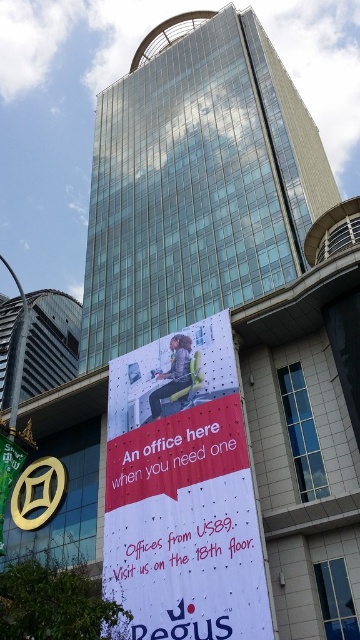
You are a delivery drone with a wingspan of 1.5 meters. You need to fly from the smooth metallic pole at left to the glassy skyscraper at upper left. Can you safely navigate the space between them without colliding?

The distance between the glassy skyscraper at upper left and the smooth metallic pole at left is 12.08 meters. Since your wingspan is only 1.5 meters, there is ample space for you to navigate safely between them without collision.

You are a window cleaner working on the glassy skyscraper at upper left. You need to clean the white paper banner at center. Which object requires a longer ladder to reach?

The glassy skyscraper at upper left requires a longer ladder because it is taller than the white paper banner at center.

You are standing on the ground floor of a building and want to visit the office mentioned in the advertisement. The advertisement says to visit the 18th floor. Considering the distance between you and the glassy skyscraper at upper left is 387.17 feet, can you estimate how many steps you need to climb to reach the 18th floor if each floor is 12 feet high and each step is 0.75 feet tall?

The glassy skyscraper at upper left is 387.17 feet away from the viewer. To reach the 18th floor, which is 18 floors multiplied by 12 feet per floor, totaling 216 feet. The total steps needed would be 216 divided by 0.75 feet per step, which equals 288 steps.